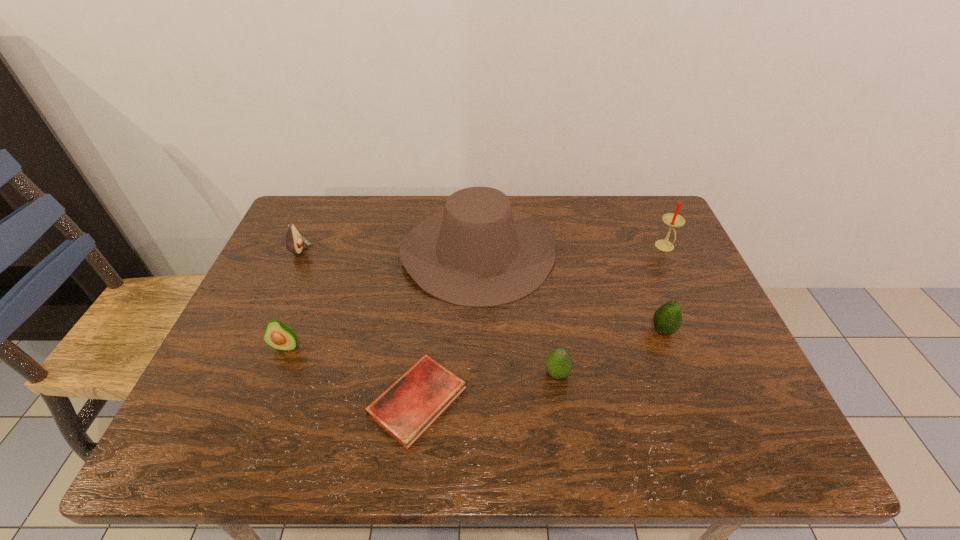
At what (x,y) coordinates should I click in order to perform the action: click on avocado that is the second closest one to the cowboy hat. Please return your answer as a coordinate pair (x, y). Image resolution: width=960 pixels, height=540 pixels. Looking at the image, I should click on (667, 319).

Find the location of a particular element. the second closest avocado to the second object from left to right is located at coordinates (559, 364).

Find the location of a particular element. vacant region that satisfies the following two spatial constraints: 1. on the seed side of the farthest avocado; 2. on the back side of the sixth object from left to right is located at coordinates (264, 330).

Where is `vacant space that satisfies the following two spatial constraints: 1. on the back side of the rightmost object; 2. on the left side of the third avocado from left to right`? The image size is (960, 540). vacant space that satisfies the following two spatial constraints: 1. on the back side of the rightmost object; 2. on the left side of the third avocado from left to right is located at coordinates (539, 247).